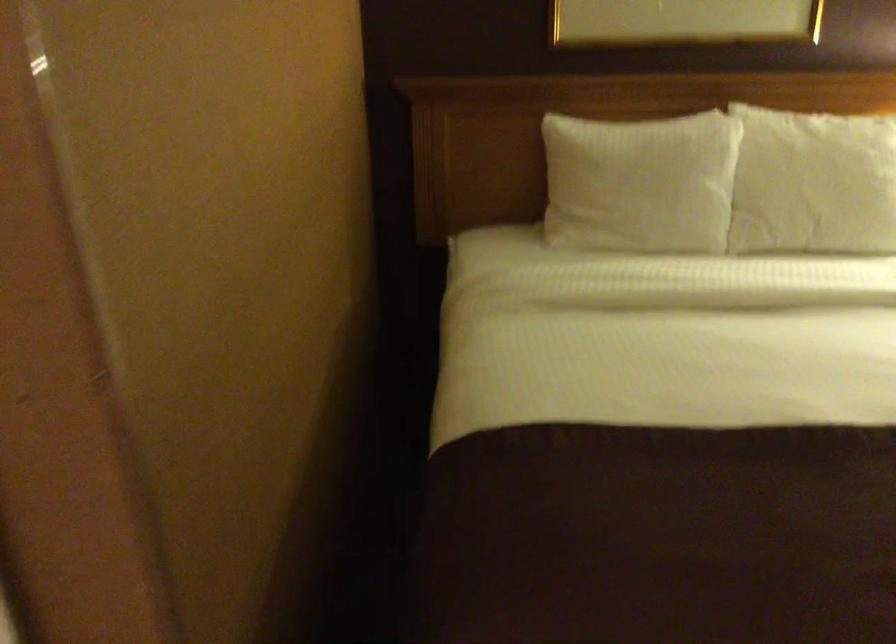
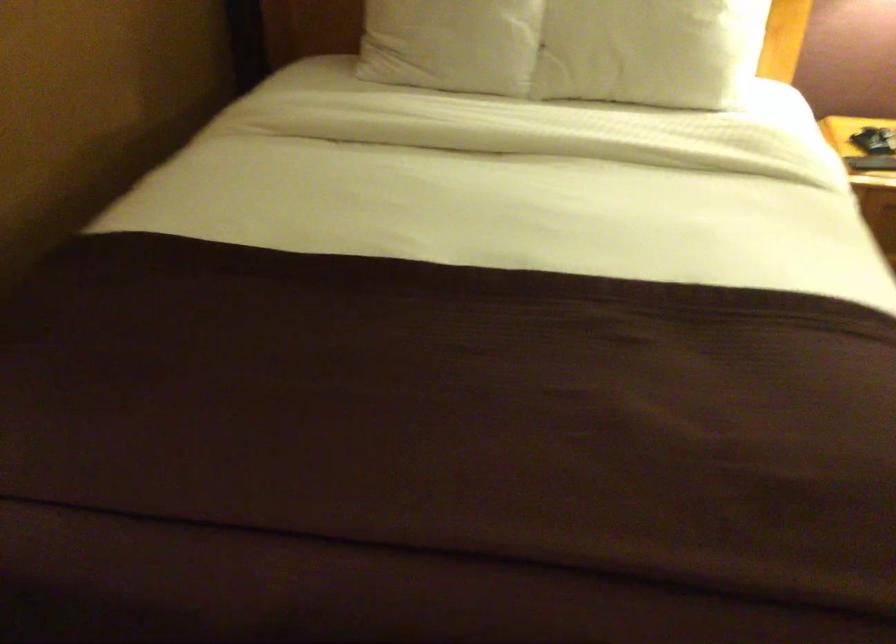
Where in the second image is the point corresponding to (x=648, y=212) from the first image?

(452, 44)